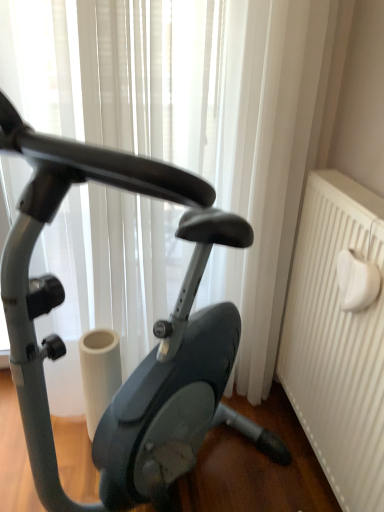
Question: Is matte black stationary bicycle at center not within white textured radiator at right?

Choices:
 (A) no
 (B) yes

Answer: (B)

Question: Considering the relative sizes of matte black stationary bicycle at center and white textured radiator at right in the image provided, is matte black stationary bicycle at center bigger than white textured radiator at right?

Choices:
 (A) yes
 (B) no

Answer: (A)

Question: Is matte black stationary bicycle at center positioned before white textured radiator at right?

Choices:
 (A) no
 (B) yes

Answer: (B)

Question: From the image's perspective, does matte black stationary bicycle at center appear higher than white textured radiator at right?

Choices:
 (A) yes
 (B) no

Answer: (A)

Question: Is matte black stationary bicycle at center next to white textured radiator at right?

Choices:
 (A) yes
 (B) no

Answer: (B)

Question: Considering the relative sizes of matte black stationary bicycle at center and white textured radiator at right in the image provided, is matte black stationary bicycle at center wider than white textured radiator at right?

Choices:
 (A) yes
 (B) no

Answer: (A)

Question: Can you confirm if white textured radiator at right is thinner than matte black stationary bicycle at center?

Choices:
 (A) yes
 (B) no

Answer: (A)

Question: Considering the relative sizes of white textured radiator at right and matte black stationary bicycle at center in the image provided, is white textured radiator at right bigger than matte black stationary bicycle at center?

Choices:
 (A) no
 (B) yes

Answer: (A)

Question: Would you say white textured radiator at right is a long distance from matte black stationary bicycle at center?

Choices:
 (A) yes
 (B) no

Answer: (B)

Question: Is the position of white textured radiator at right less distant than that of matte black stationary bicycle at center?

Choices:
 (A) yes
 (B) no

Answer: (B)

Question: Does white textured radiator at right come behind matte black stationary bicycle at center?

Choices:
 (A) no
 (B) yes

Answer: (B)

Question: Is white textured radiator at right completely or partially outside of matte black stationary bicycle at center?

Choices:
 (A) yes
 (B) no

Answer: (A)

Question: From the image's perspective, is matte black stationary bicycle at center located above or below white textured radiator at right?

Choices:
 (A) above
 (B) below

Answer: (A)